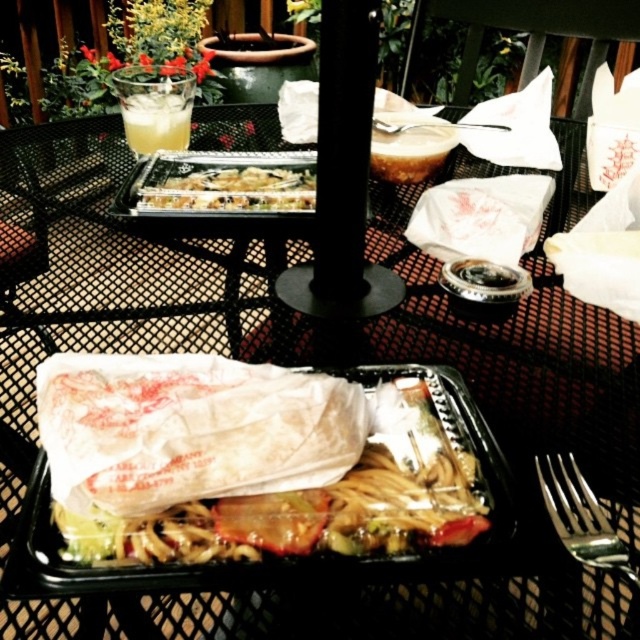
Question: Considering the real-world distances, which object is farthest from the translucent plastic tray at center?

Choices:
 (A) clear plastic container at center
 (B) silver metallic fork at center
 (C) clear glass cup at upper left
 (D) silver metallic fork at lower right

Answer: (B)

Question: Considering the real-world distances, which object is farthest from the silver metallic fork at lower right?

Choices:
 (A) silver metallic fork at center
 (B) clear glass cup at upper left

Answer: (B)

Question: Does silver metallic fork at lower right have a lesser width compared to silver metallic fork at center?

Choices:
 (A) yes
 (B) no

Answer: (A)

Question: Observing the image, what is the correct spatial positioning of silver metallic fork at lower right in reference to clear glass cup at upper left?

Choices:
 (A) left
 (B) right

Answer: (B)

Question: Is translucent plastic tray at center behind clear glass cup at upper left?

Choices:
 (A) yes
 (B) no

Answer: (B)

Question: Among these points, which one is farthest from the camera?

Choices:
 (A) (156, 528)
 (B) (486, 24)
 (C) (406, 129)

Answer: (B)